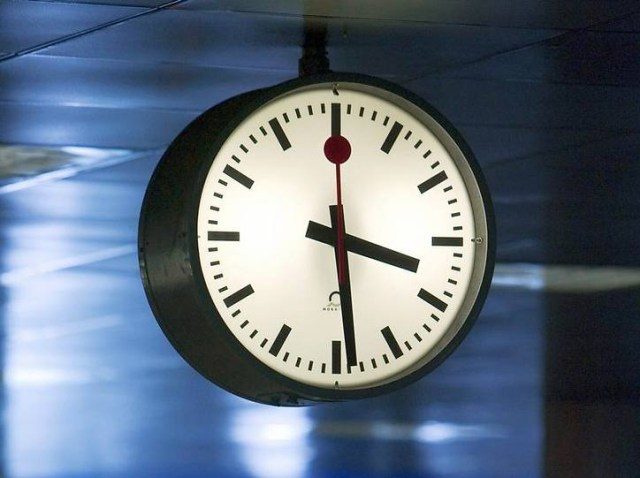
Locate an element on the screen. The height and width of the screenshot is (478, 640). black clock is located at coordinates (214, 338).